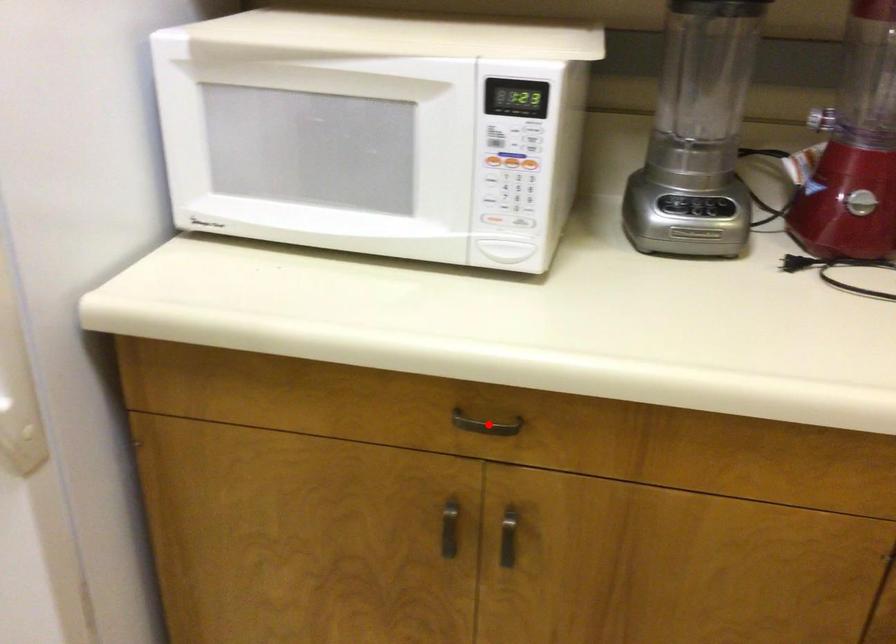
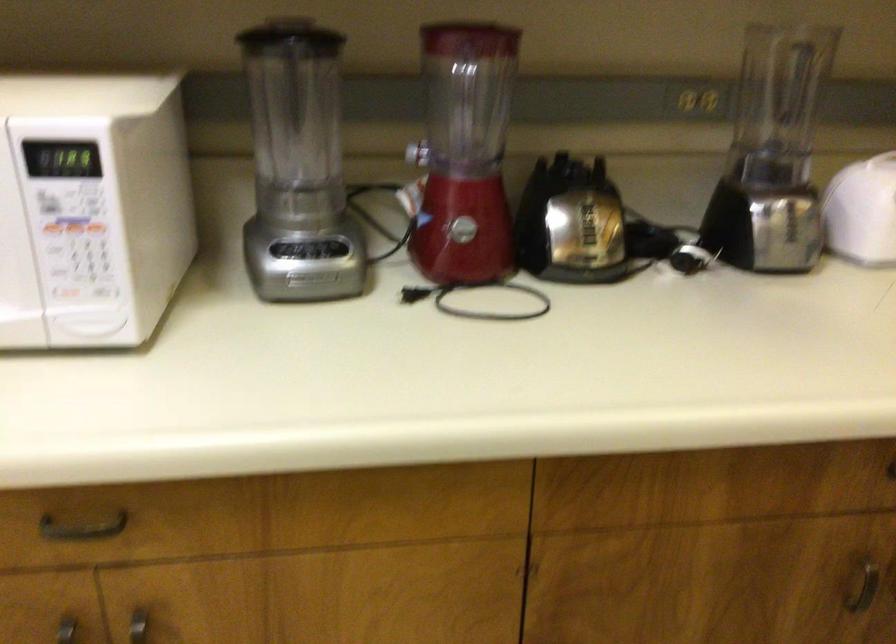
Question: I am providing you with two images of the same scene from different viewpoints. Image1 has a red point marked. In image2, the corresponding 3D location appears at what relative position? Reply with the corresponding letter.

Choices:
 (A) Closer
 (B) Farther

Answer: (A)